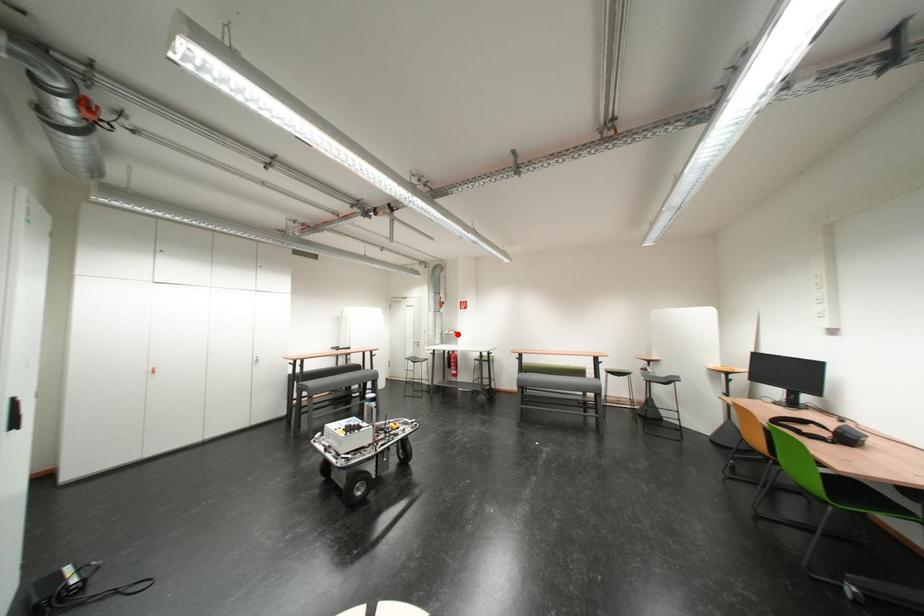
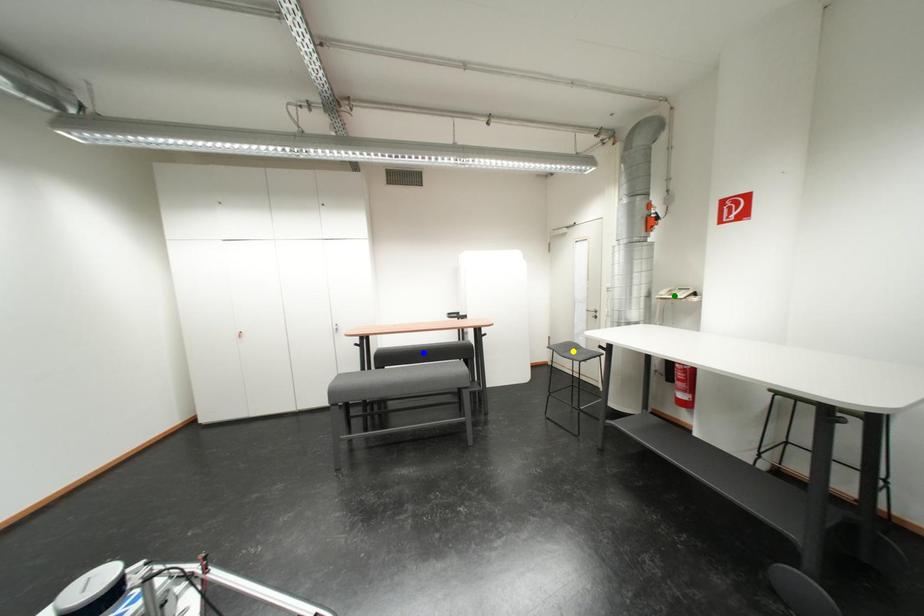
Question: I am providing you with two images of the same scene from different viewpoints. A red point is marked on the first image. You are given multiple points on the second image. Which point in image 2 is actually the same real-world point as the red point in image 1?

Choices:
 (A) blue point
 (B) green point
 (C) yellow point

Answer: (B)